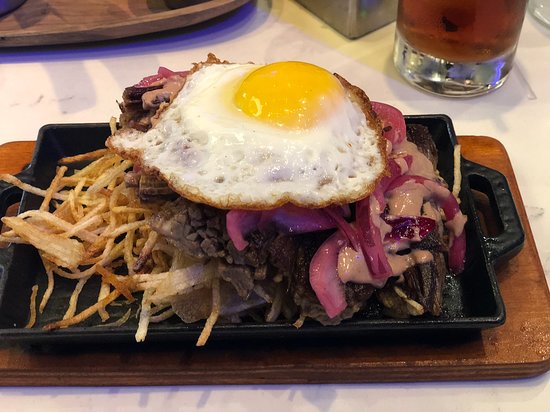
You are a GUI agent. You are given a task and a screenshot of the screen. Output one action in this format:
    pyautogui.click(x=<x>, y=<y>)
    Task: Click on the table top
    
    Given the screenshot: What is the action you would take?
    [510, 399]